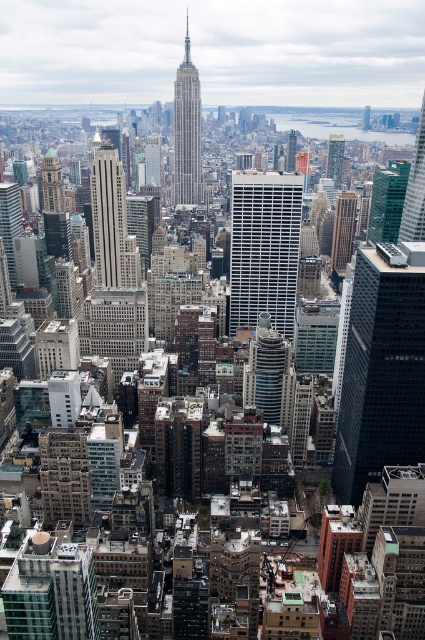
Between green glass skyscraper at right and gold textured clock tower at left, which one has less height?

With less height is gold textured clock tower at left.

Between point (419, 138) and point (62, 193), which one is positioned in front?

Point (62, 193) is more forward.

Where is `green glass skyscraper at right`? green glass skyscraper at right is located at coordinates (414, 188).

Who is positioned more to the right, matte gray skyscraper at center or gold textured clock tower at left?

From the viewer's perspective, matte gray skyscraper at center appears more on the right side.

Measure the distance between point (104, 202) and camera.

Point (104, 202) is 659.17 meters away from camera.

Is point (124, 212) positioned behind point (42, 161)?

No, it is not.

I want to click on matte gray skyscraper at center, so click(110, 218).

Does dark glass skyscraper at center-right lie behind silver metallic skyscraper at center?

No, it is in front of silver metallic skyscraper at center.

Who is more distant from viewer, (404, 429) or (195, 68)?

Point (195, 68)

I want to click on dark glass skyscraper at center-right, so click(382, 369).